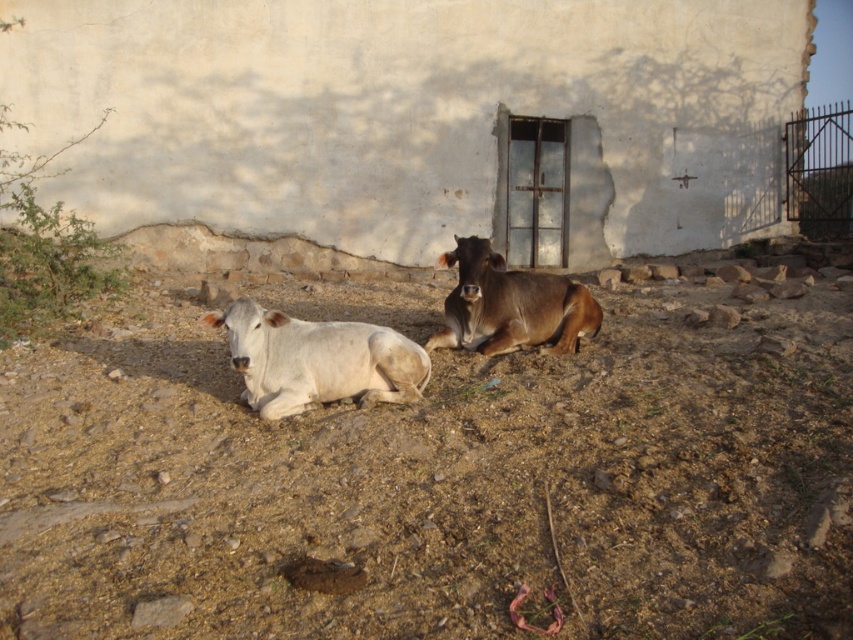
Which is in front, point (83, 477) or point (544, 328)?

Positioned in front is point (83, 477).

Is point (152, 301) positioned in front of point (543, 321)?

That is False.

Is point (221, 417) less distant than point (496, 289)?

Yes, it is in front of point (496, 289).

Locate an element on the screen. brown soil at center is located at coordinates (437, 483).

Which is in front, point (317, 364) or point (492, 308)?

Point (317, 364)

Find the location of a particular element. This screenshot has height=640, width=853. white smooth cow at center is located at coordinates (317, 360).

Which is behind, point (339, 378) or point (490, 275)?

Positioned behind is point (490, 275).

At what (x,y) coordinates should I click in order to perform the action: click on white smooth cow at center. Please return your answer as a coordinate pair (x, y). This screenshot has height=640, width=853. Looking at the image, I should click on point(317,360).

Is brown soil at center bigger than white smooth cow at center?

No, brown soil at center is not bigger than white smooth cow at center.

From the picture: Who is positioned more to the left, brown soil at center or white smooth cow at center?

brown soil at center is more to the left.

Does point (96, 356) lie behind point (335, 364)?

That is True.

At what (x,y) coordinates should I click in order to perform the action: click on brown soil at center. Please return your answer as a coordinate pair (x, y). The image size is (853, 640). Looking at the image, I should click on (437, 483).